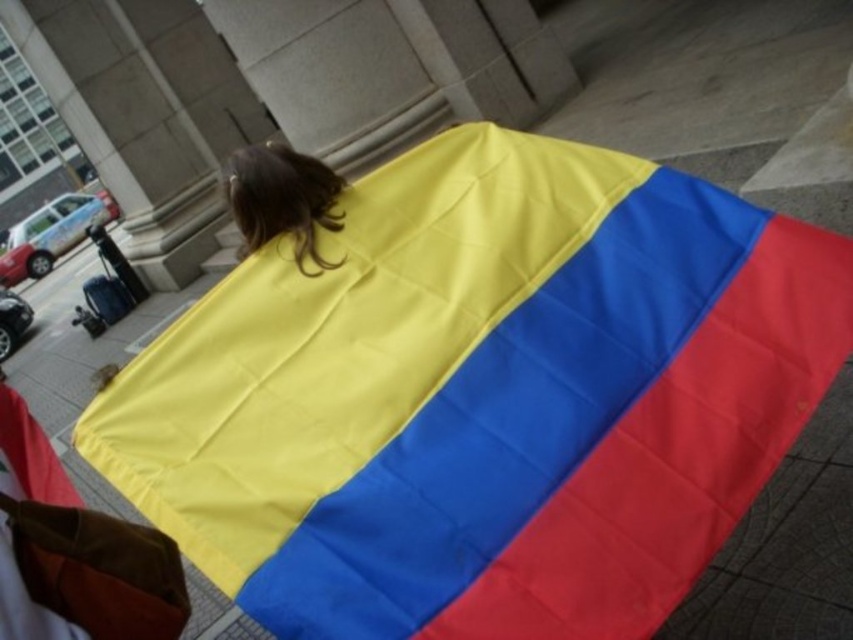
You are a photographer trying to capture the Colombian flag in the image. The flag is at the center. There is a point at coordinates point (482,396). Can you determine which color this point is on?

The point (482,396) is on the polyester flag at center, so the color depends on the flag design. The Colombian flag has three horizontal stripes from top to bottom yellow, blue, and red. Since the point is on the flag, it must be either yellow, blue, or red. However, without exact measurements, we can only say it is on the polyester flag at center.

You are a photographer trying to capture the shiny brown hair at upper center and the polyester flag at center in a single shot. Based on their positions, can you tell which object is closer to the camera?

The polyester flag at center is below shiny brown hair at upper center, so the shiny brown hair at upper center is closer to the camera.

You are a photographer trying to capture the polyester flag at center in your shot. The camera is currently positioned at point 0.5,0.5. What direction should you move the camera to align the flag properly?

The polyester flag at center is located at point (482, 396). Since the camera is at (426, 320), you should move the camera slightly to the right and upward to align with the flag.